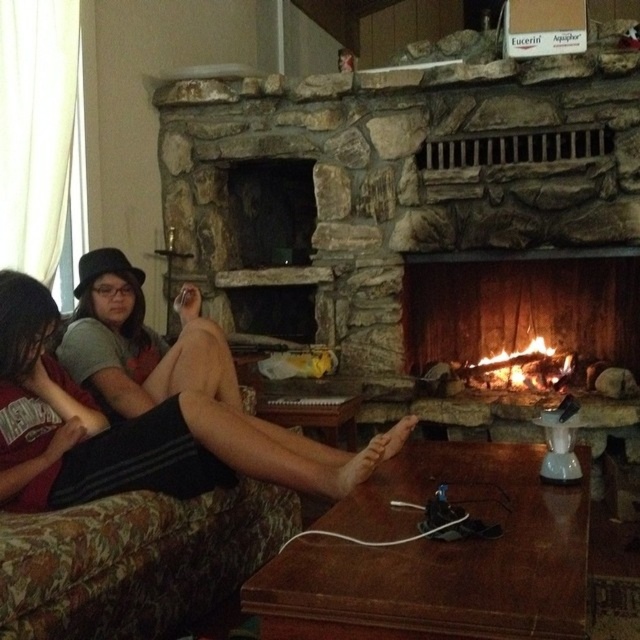
You are a firefighter assessing a fire in a fireplace. You observe the wooden logs burning at center and the charcoal wood fire at center. Which object is closer to the front of the fireplace?

The wooden logs burning at center is closer to the front of the fireplace because it is in front of the charcoal wood fire at center.

You are standing in the room and want to place a new decorative item on the mantel shelf above the fireplace. The mantel shelf is located at point coordinates of 0.623, 0.457. The wooden logs burning at center are at 0.481, 0.816. Based on these coordinates, will the mantel shelf be visible above the fireplace when looking from the couch where the two people are seated?

The mantel shelf is located at coordinates (292, 397) and the wooden logs burning at center are at (522, 307). Since the mantel shelf has a lower y coordinate than the logs, it is positioned higher up on the image. Therefore, the mantel shelf above the fireplace will be visible from the couch where the two people are seated.